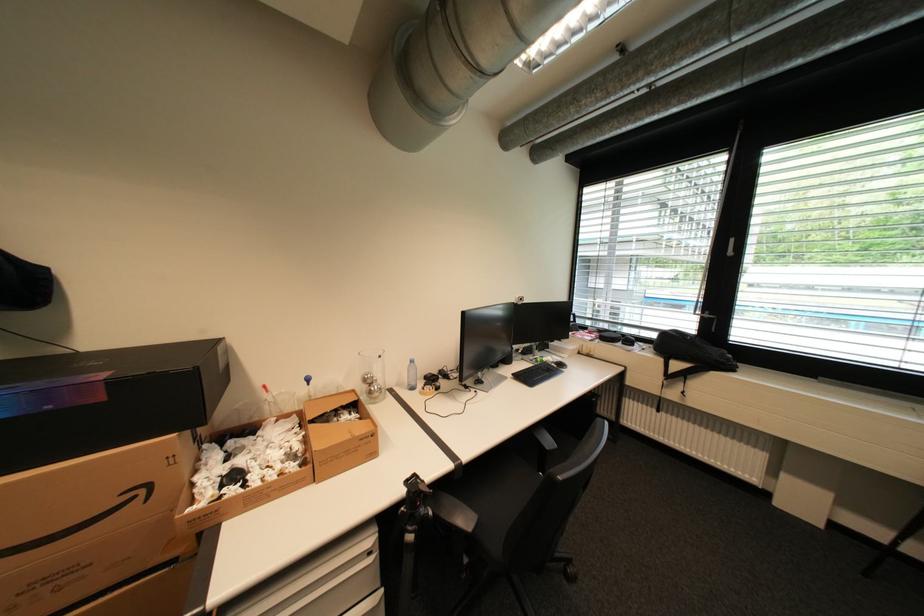
Find where to pull the gray cabinet handle. Please return your answer as a coordinate pair (x, y).

(736, 323)